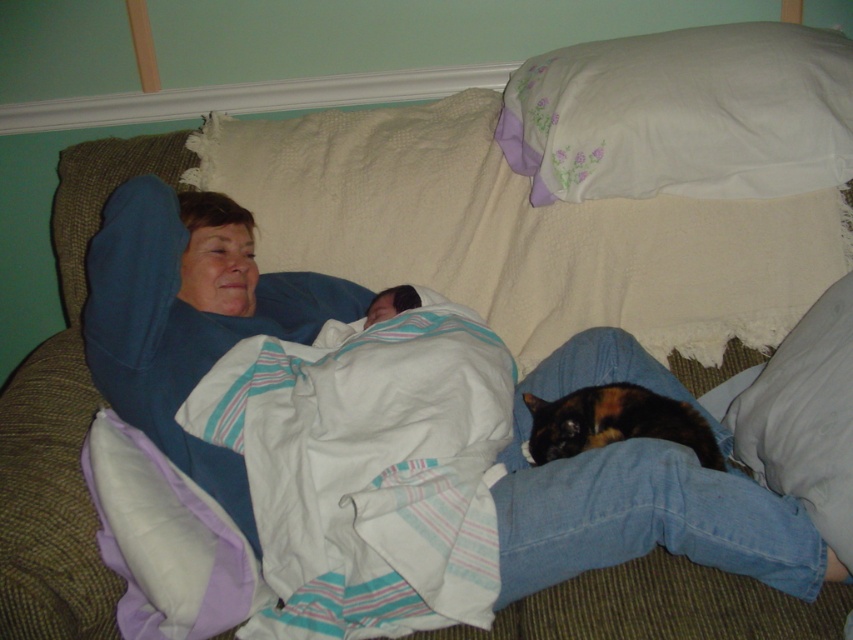
Question: Is white textured blanket at center wider than white soft pillow at lower right?

Choices:
 (A) no
 (B) yes

Answer: (B)

Question: Does white textured blanket at center have a lesser width compared to white cotton pillow at upper right?

Choices:
 (A) yes
 (B) no

Answer: (B)

Question: Can you confirm if white textured blanket at center is positioned above white cotton pillow at upper right?

Choices:
 (A) no
 (B) yes

Answer: (A)

Question: Among these points, which one is farthest from the camera?

Choices:
 (A) (531, 451)
 (B) (810, 460)
 (C) (277, 221)

Answer: (C)

Question: Which object is closer to the camera taking this photo?

Choices:
 (A) white cotton pillow at upper right
 (B) calico fur cat at lower right
 (C) white soft pillow at lower right
 (D) white textured blanket at center

Answer: (C)

Question: Based on their relative distances, which object is nearer to the white soft pillow at lower right?

Choices:
 (A) white cotton pillow at upper right
 (B) calico fur cat at lower right
 (C) white textured blanket at center

Answer: (B)